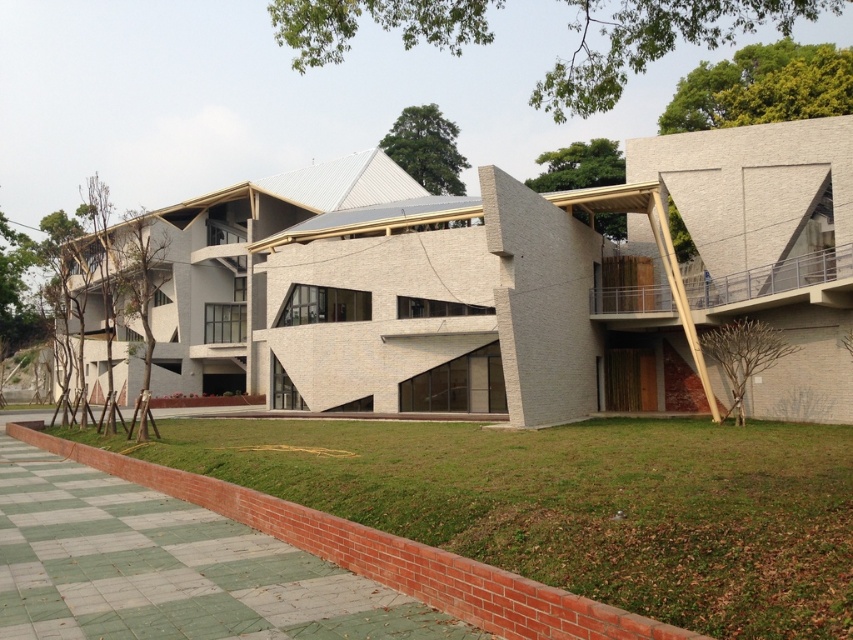
Question: Among these points, which one is nearest to the camera?

Choices:
 (A) (281, 392)
 (B) (392, 515)

Answer: (B)

Question: Does white textured building at center appear over green grass at lower left?

Choices:
 (A) no
 (B) yes

Answer: (B)

Question: Is white textured building at center to the right of green grass at lower left from the viewer's perspective?

Choices:
 (A) yes
 (B) no

Answer: (B)

Question: Considering the relative positions of white textured building at center and green grass at lower left in the image provided, where is white textured building at center located with respect to green grass at lower left?

Choices:
 (A) above
 (B) below

Answer: (A)